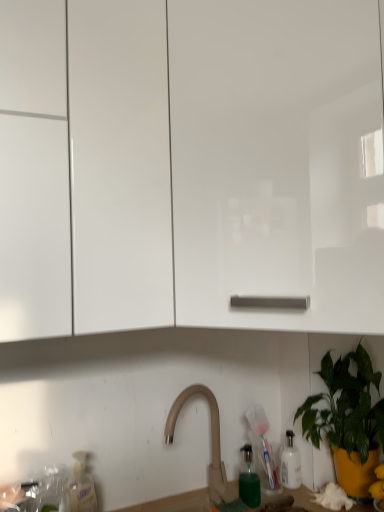
Question: Should I look upward or downward to see white matte cabinet at center, which is counted as the 2th cabinetry, starting from the left?

Choices:
 (A) up
 (B) down

Answer: (A)

Question: Considering the relative sizes of beige matte faucet at center and green glossy plant at lower right in the image provided, is beige matte faucet at center smaller than green glossy plant at lower right?

Choices:
 (A) yes
 (B) no

Answer: (A)

Question: Can you confirm if beige matte faucet at center is taller than green glossy plant at lower right?

Choices:
 (A) yes
 (B) no

Answer: (B)

Question: From the image's perspective, is beige matte faucet at center located beneath green glossy plant at lower right?

Choices:
 (A) yes
 (B) no

Answer: (A)

Question: Could green glossy plant at lower right be considered to be inside beige matte faucet at center?

Choices:
 (A) no
 (B) yes

Answer: (A)

Question: From the image's perspective, does beige matte faucet at center appear higher than green glossy plant at lower right?

Choices:
 (A) yes
 (B) no

Answer: (B)

Question: Can you confirm if beige matte faucet at center is shorter than green glossy plant at lower right?

Choices:
 (A) no
 (B) yes

Answer: (B)

Question: From the image's perspective, would you say white glossy cabinet at upper left, the first cabinetry from the left, is positioned over green glossy plant at lower right?

Choices:
 (A) yes
 (B) no

Answer: (A)

Question: Could you tell me if white glossy cabinet at upper left, arranged as the 2th cabinetry when viewed from the right, is facing green glossy plant at lower right?

Choices:
 (A) yes
 (B) no

Answer: (B)

Question: From a real-world perspective, is white glossy cabinet at upper left, arranged as the 2th cabinetry when viewed from the right, located higher than green glossy plant at lower right?

Choices:
 (A) no
 (B) yes

Answer: (B)

Question: Can you confirm if white glossy cabinet at upper left, arranged as the 2th cabinetry when viewed from the right, is bigger than green glossy plant at lower right?

Choices:
 (A) yes
 (B) no

Answer: (A)

Question: Is white glossy cabinet at upper left, the first cabinetry from the left, beside green glossy plant at lower right?

Choices:
 (A) no
 (B) yes

Answer: (A)

Question: Would you consider white glossy cabinet at upper left, arranged as the 2th cabinetry when viewed from the right, to be distant from green glossy plant at lower right?

Choices:
 (A) yes
 (B) no

Answer: (B)

Question: Considering the relative sizes of white glossy cabinet at upper left, the first cabinetry from the left, and beige matte faucet at center in the image provided, is white glossy cabinet at upper left, the first cabinetry from the left, bigger than beige matte faucet at center?

Choices:
 (A) no
 (B) yes

Answer: (B)